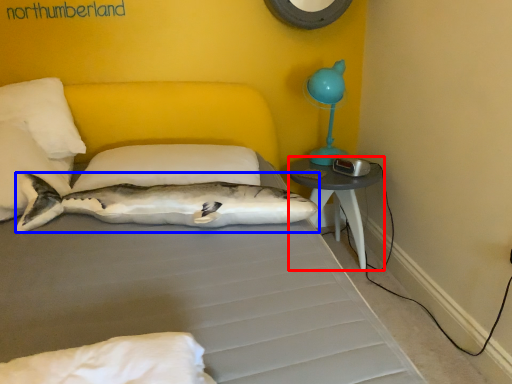
Question: Which point is further to the camera, nightstand (highlighted by a red box) or shark (highlighted by a blue box)?

Choices:
 (A) nightstand
 (B) shark

Answer: (A)